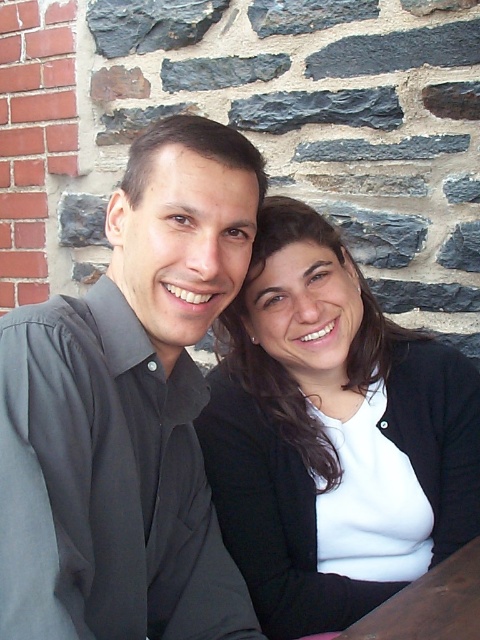
Question: Where is black shirt at left located in relation to white matte/black textured blazer at center in the image?

Choices:
 (A) left
 (B) right

Answer: (A)

Question: Among these points, which one is farthest from the camera?

Choices:
 (A) (101, 508)
 (B) (236, 476)

Answer: (B)

Question: Which of the following is the farthest from the observer?

Choices:
 (A) black shirt at left
 (B) white matte/black textured blazer at center

Answer: (B)

Question: Which point is closer to the camera?

Choices:
 (A) (420, 474)
 (B) (444, 595)
 (C) (166, 388)

Answer: (B)

Question: Does black shirt at left appear over brown wooden table at lower right?

Choices:
 (A) yes
 (B) no

Answer: (A)

Question: Does black shirt at left appear over brown wooden table at lower right?

Choices:
 (A) no
 (B) yes

Answer: (B)